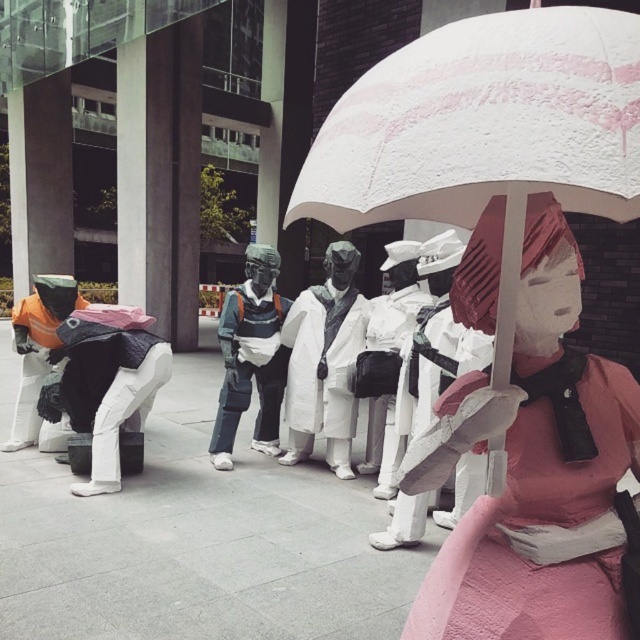
You are an artist planning to place a small decorative pin on either the white matte coat at center or the metallic silver helmet at center. Based on their sizes, which object would allow the pin to be more prominently visible?

The metallic silver helmet at center is larger than the white matte coat at center, so placing the pin on the metallic silver helmet at center would make it more prominently visible.

You are an art curator planning to move the pink matte umbrella at upper center and the white matte coat at center to a new exhibition space. The new space has limited floor area. Which object should you prioritize moving first to save space?

The pink matte umbrella at upper center should be prioritized because it occupies less space than the white matte coat at center, making it easier to move first to conserve floor area.

You are a drone operator flying a drone that needs to capture a photo of the metallic silver helmet at center without the white matte umbrella at center blocking it. What should you do?

The white matte umbrella at center is above the metallic silver helmet at center, so you should fly the drone below the white matte umbrella at center to capture the photo without obstruction.